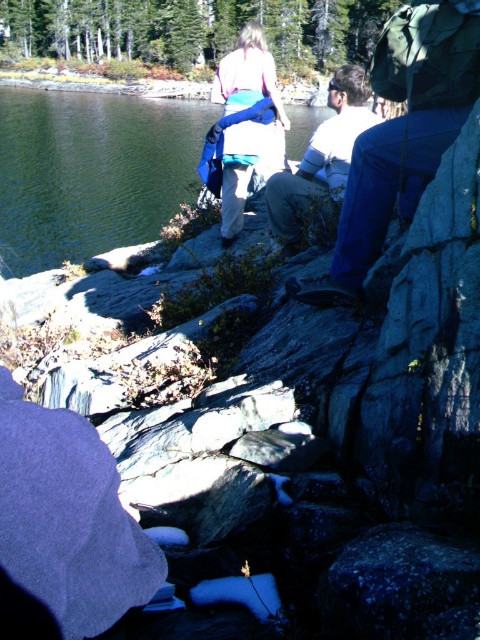
You are standing at the point with coordinates point (360, 195) and want to walk towards the point (6, 212). Which direction should you move relative to your current position?

You should move forward because point (6, 212) is closer to the viewer than point (360, 195), so moving forward from your current position will take you towards it.

You are standing at the edge of the water in the scene and want to reach the white cotton shirt at center without getting wet. The green liquid water at left is in your way. Can you walk around the water to reach the shirt? Explain your reasoning.

The green liquid water at left and white cotton shirt at center are 29.99 meters apart. Since the water is at the left and the shirt is at the center, there might be a path around the water to reach the shirt. However, the distance between them is quite large, so you would need to walk around the water for about 30 meters to reach the shirt without getting wet.

You are standing at the center of the image and want to place a new object exactly where the matte blue backpack at center is located. What are the coordinates you should input into the system to place the new object at the same position?

The coordinates to place the new object at the same position as the matte blue backpack at center are 0.194 in the x direction and 0.515 in the y direction.